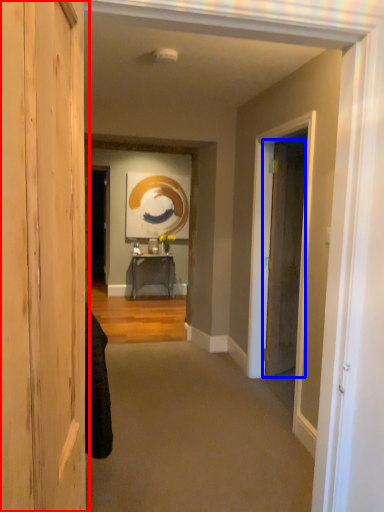
Question: Which object appears closest to the camera in this image, door (highlighted by a red box) or door (highlighted by a blue box)?

Choices:
 (A) door
 (B) door

Answer: (A)